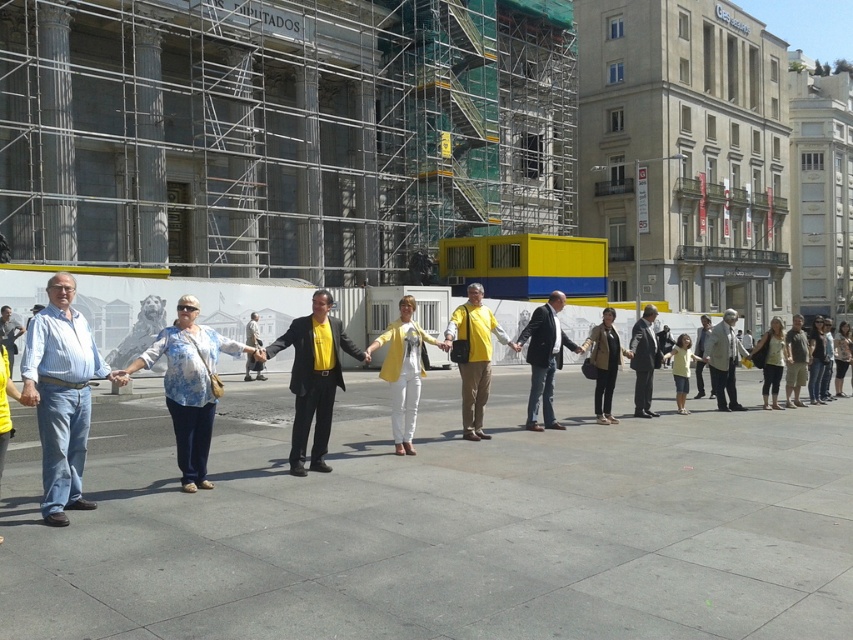
You are a photographer trying to capture the denim jeans at left in the center of your photo. Given their current position at point 0.617, 0.073, would you need to adjust your camera angle to the left or right to center them?

The denim jeans at left are located at point (x=61, y=394). To center them in the photo, you would need to adjust the camera angle to the right since the x coordinate 0.617 is to the right of the center point at 0.5.

You are part of a photography team capturing the event. You need to position a camera to ensure both the matte black suit at center and the light gray suit at center are visible in the frame. Given their positions, which one should you focus on first to include both in the shot?

The matte black suit at center is located below the light gray suit at center. To include both in the frame, focus on the light gray suit at center first as it is higher up, allowing the camera to capture the lower positioned matte black suit at center in the same shot.

Consider the image. You are a photographer trying to capture a group photo of the people in the scene. You notice the denim jeans at left and the light brown leather jacket at right. Which clothing item should you adjust to ensure both appear proportionally sized in the frame?

Since the denim jeans at left is narrower than the light brown leather jacket at right, you should adjust the denim jeans at left to widen its position so both appear proportionally sized in the frame.